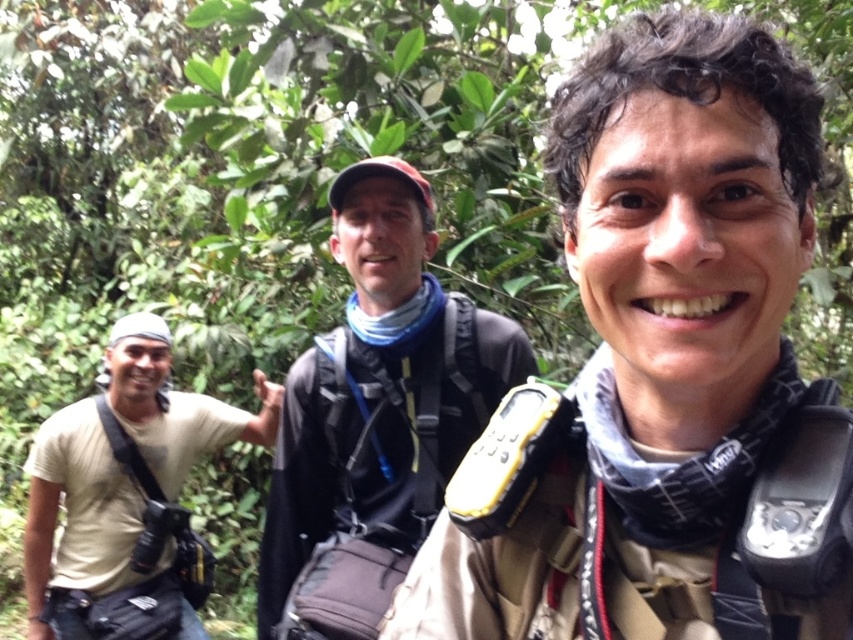
Question: Is matte black backpack at center thinner than light beige t-shirt at left?

Choices:
 (A) no
 (B) yes

Answer: (B)

Question: Is the position of matte black jacket at center more distant than that of light beige t-shirt at left?

Choices:
 (A) no
 (B) yes

Answer: (A)

Question: Which point is farther to the camera?

Choices:
 (A) (120, 365)
 (B) (589, 477)
 (C) (281, 627)

Answer: (A)

Question: Estimate the real-world distances between objects in this image. Which object is farther from the matte black backpack at center?

Choices:
 (A) matte black jacket at center
 (B) light beige t-shirt at left

Answer: (B)

Question: Does matte black backpack at center have a larger size compared to light beige t-shirt at left?

Choices:
 (A) no
 (B) yes

Answer: (A)

Question: Considering the real-world distances, which object is closest to the light beige t-shirt at left?

Choices:
 (A) matte black backpack at center
 (B) matte black jacket at center

Answer: (B)